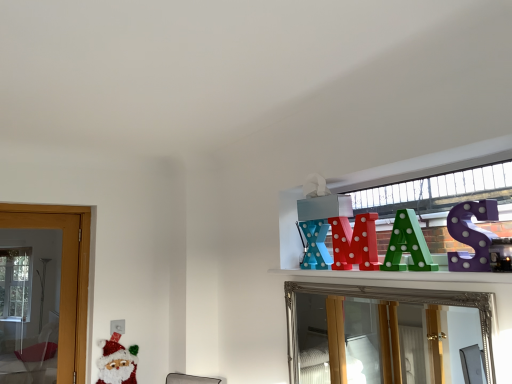
Question: Would you say purple polka dot letter at upper right, arranged as the 4th toy when viewed from the back, is to the left or to the right of silver/glass mirror at upper center in the picture?

Choices:
 (A) left
 (B) right

Answer: (B)

Question: Relative to silver/glass mirror at upper center, is purple polka dot letter at upper right, which appears as the 1th toy when viewed from the front, in front or behind?

Choices:
 (A) behind
 (B) front

Answer: (A)

Question: Which object is the closest to the matte plastic letter x at upper center, marked as the 1th toy in a left-to-right arrangement?

Choices:
 (A) shiny red letter at upper center, arranged as the third toy when viewed from the right
 (B) felt santa claus at lower left
 (C) green polka dot letter a at upper center, the 2th toy when ordered from front to back
 (D) silver/glass mirror at upper center
 (E) purple polka dot letter at upper right, the fourth toy positioned from the left

Answer: (A)

Question: Which of these objects is positioned farthest from the shiny red letter at upper center, which is the 2th toy from back to front?

Choices:
 (A) felt santa claus at lower left
 (B) matte plastic letter x at upper center, which is the first toy in back-to-front order
 (C) green polka dot letter a at upper center, the 2th toy when ordered from front to back
 (D) silver/glass mirror at upper center
 (E) purple polka dot letter at upper right, arranged as the 4th toy when viewed from the back

Answer: (A)